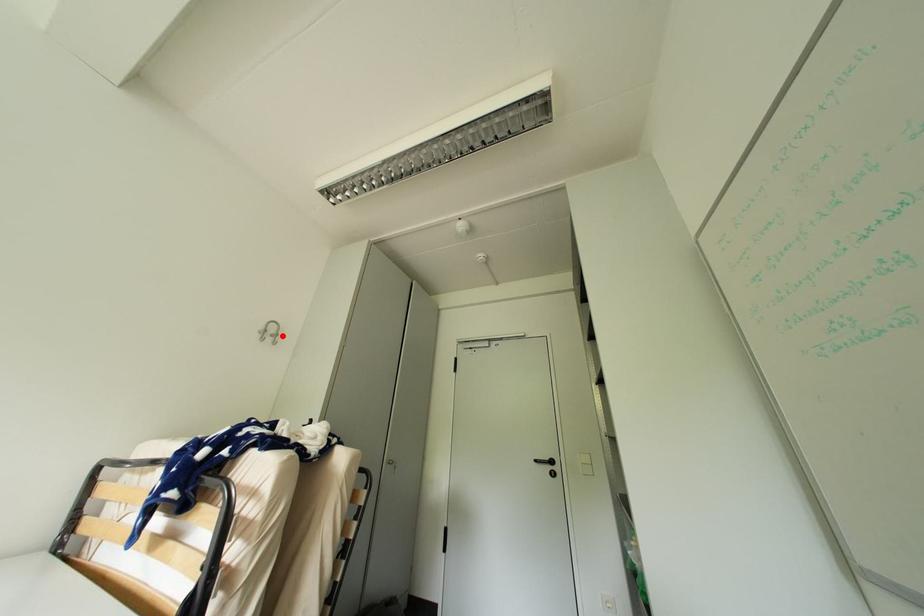
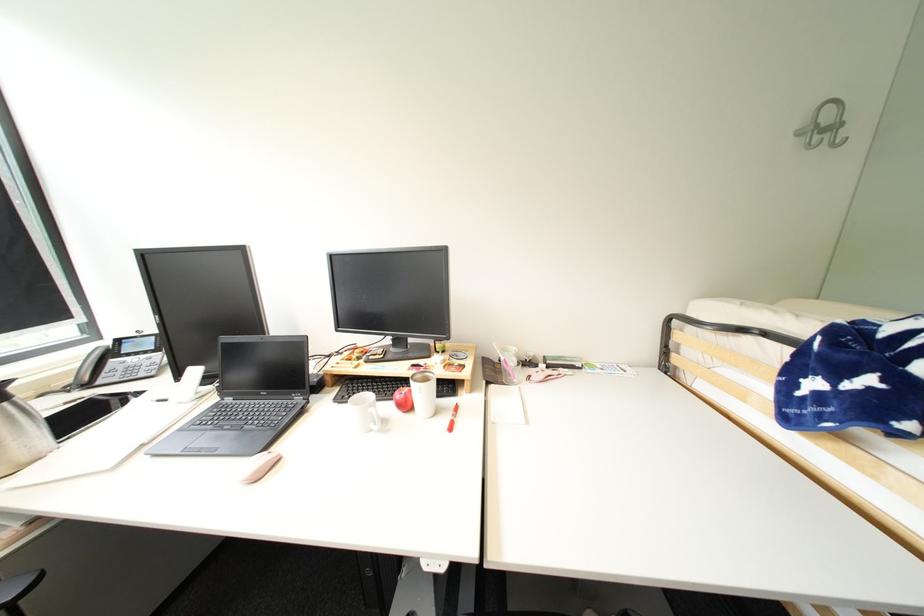
In the second image, find the point that corresponds to the highlighted location in the first image.

(841, 128)